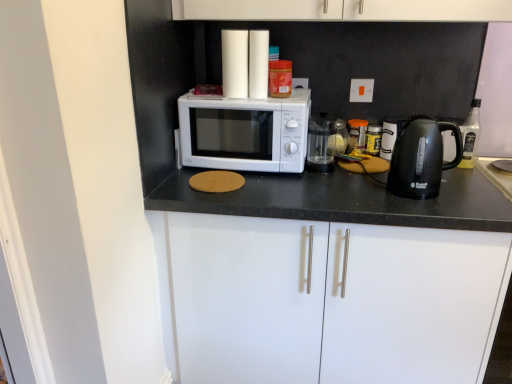
Question: Do you think white matte cabinet at center, which is the 1th cabinetry from bottom to top, is within white matte microwave at center, or outside of it?

Choices:
 (A) outside
 (B) inside

Answer: (A)

Question: From a real-world perspective, is white matte cabinet at center, which is the second cabinetry from top to bottom, positioned above or below white matte microwave at center?

Choices:
 (A) above
 (B) below

Answer: (B)

Question: Which object is positioned closest to the black plastic kettle at right?

Choices:
 (A) white matte cabinet at center, which is the 1th cabinetry from bottom to top
 (B) white matte microwave at center
 (C) transparent glass coffee maker at center
 (D) black plastic bottle at right
 (E) white matte cabinet doors at upper center, the second cabinetry positioned from the bottom

Answer: (C)

Question: Based on their relative distances, which object is nearer to the transparent glass coffee maker at center?

Choices:
 (A) white matte cabinet at center, which is the 1th cabinetry from bottom to top
 (B) white matte cabinet doors at upper center, the second cabinetry positioned from the bottom
 (C) black plastic bottle at right
 (D) white matte microwave at center
 (E) black plastic kettle at right

Answer: (D)